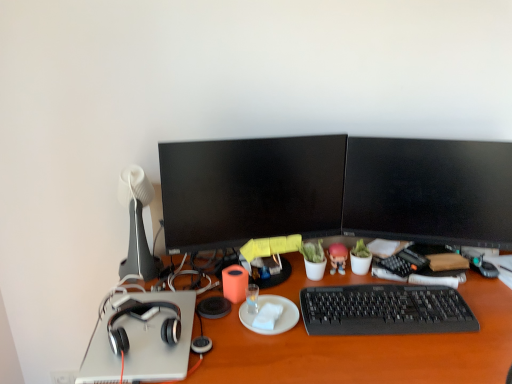
Where is `vacant space in front of white matte plate at center`? Image resolution: width=512 pixels, height=384 pixels. vacant space in front of white matte plate at center is located at coordinates (274, 360).